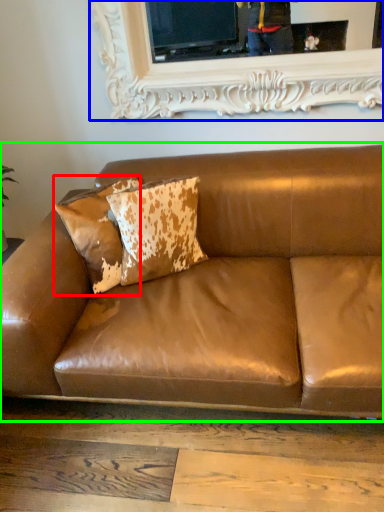
Question: Based on their relative distances, which object is nearer to pillow (highlighted by a red box)? Choose from picture frame (highlighted by a blue box) and studio couch (highlighted by a green box).

Choices:
 (A) picture frame
 (B) studio couch

Answer: (B)